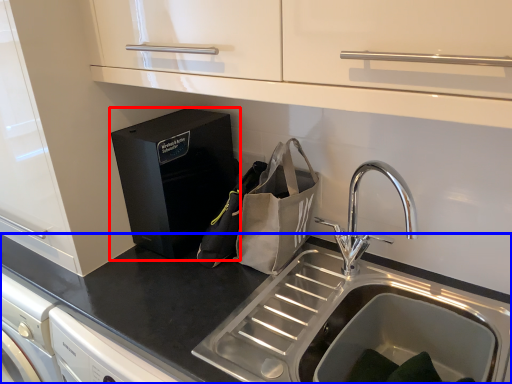
Question: Among these objects, which one is nearest to the camera, home appliance (highlighted by a red box) or countertop (highlighted by a blue box)?

Choices:
 (A) home appliance
 (B) countertop

Answer: (B)